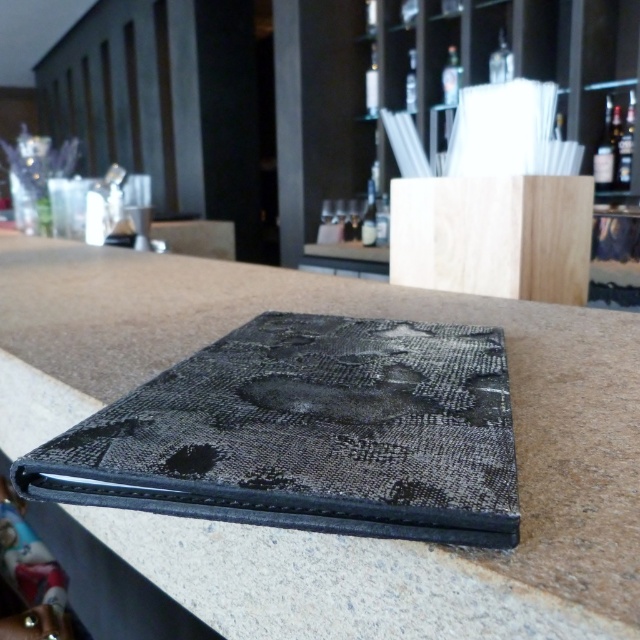
Question: Is translucent glass bottle at upper center bigger than matte glass bottle at center?

Choices:
 (A) yes
 (B) no

Answer: (A)

Question: Observing the image, what is the correct spatial positioning of translucent glass bottle at upper center in reference to transparent glass bottle at upper center?

Choices:
 (A) above
 (B) below

Answer: (B)

Question: Which point is closer to the camera?

Choices:
 (A) (618, 176)
 (B) (605, 188)

Answer: (B)

Question: Does black leather wallet at center have a lesser width compared to matte glass bottle at center?

Choices:
 (A) no
 (B) yes

Answer: (A)

Question: Which object appears closest to the camera in this image?

Choices:
 (A) matte black bottle at upper right
 (B) matte glass bottle at center
 (C) clear glass bottle at upper right
 (D) translucent glass bottle at upper right

Answer: (A)

Question: Considering the real-world distances, which object is closest to the matte black bottle at upper right?

Choices:
 (A) transparent glass bottle at upper center
 (B) translucent glass bottle at upper center
 (C) translucent glass bottle at upper right
 (D) clear glass bottle at upper center

Answer: (C)